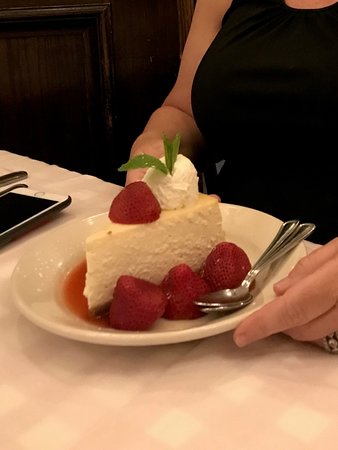
Image resolution: width=338 pixels, height=450 pixels. Identify the location of tablecloth. (81, 394).